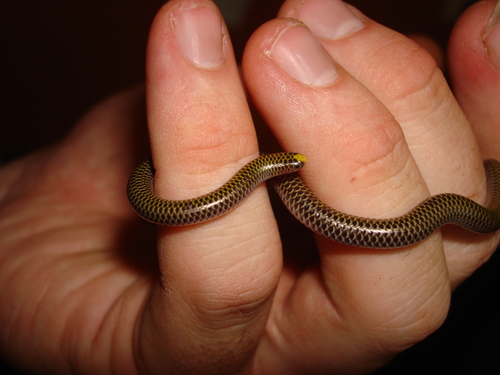
Locate an element on the screen. The image size is (500, 375). scales is located at coordinates (359, 237), (352, 238), (346, 235), (366, 237), (374, 240), (381, 240).